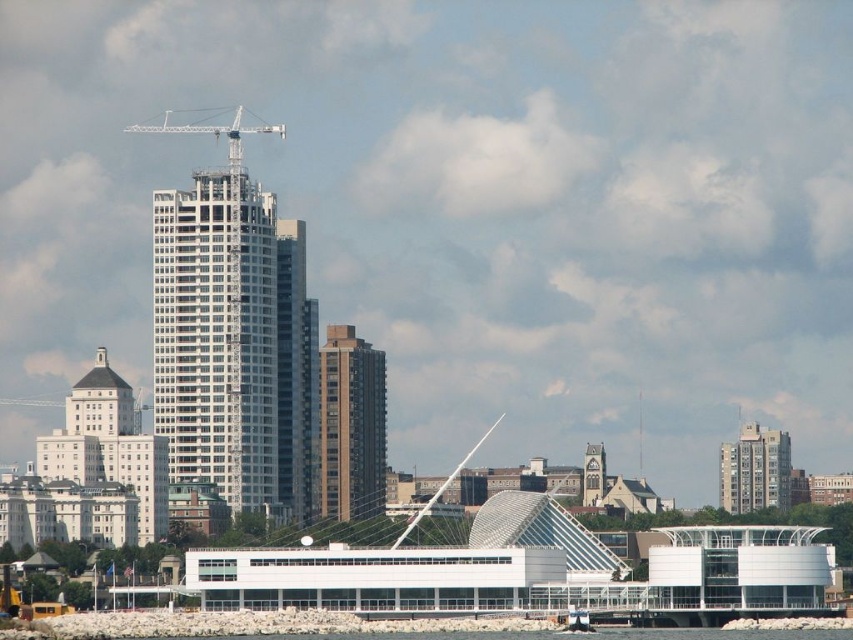
Which is behind, point (138, 474) or point (280, 136)?

Positioned behind is point (138, 474).

Is white smooth building at left to the right of white metallic crane at upper center from the viewer's perspective?

In fact, white smooth building at left is to the left of white metallic crane at upper center.

The width and height of the screenshot is (853, 640). What do you see at coordinates (109, 445) in the screenshot? I see `white smooth building at left` at bounding box center [109, 445].

Locate an element on the screen. The height and width of the screenshot is (640, 853). white smooth building at left is located at coordinates (109, 445).

Between white smooth building at left and gray concrete building at right, which one appears on the right side from the viewer's perspective?

gray concrete building at right

Locate an element on the screen. This screenshot has height=640, width=853. white smooth building at left is located at coordinates (109, 445).

Can you confirm if white glass building at center is bigger than gray concrete building at right?

Yes.

Who is higher up, white glass building at center or gray concrete building at right?

white glass building at center

Locate an element on the screen. Image resolution: width=853 pixels, height=640 pixels. white glass building at center is located at coordinates (218, 337).